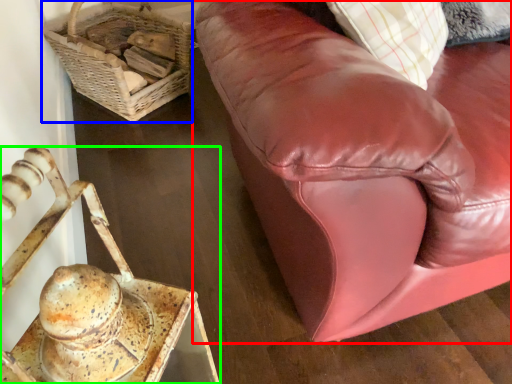
Question: Based on their relative distances, which object is farther from studio couch (highlighted by a red box)? Choose from basket (highlighted by a blue box) and furniture (highlighted by a green box).

Choices:
 (A) basket
 (B) furniture

Answer: (A)